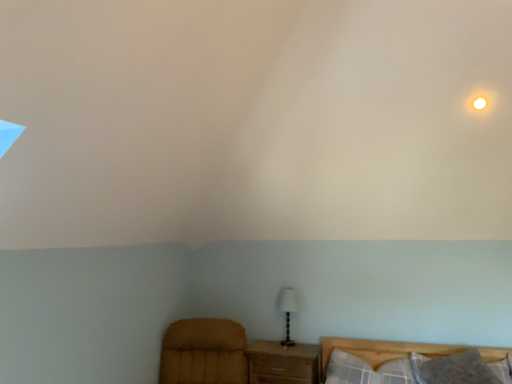
Identify the location of free space above wooden nightstand at lower center (from a real-world perspective). (283, 347).